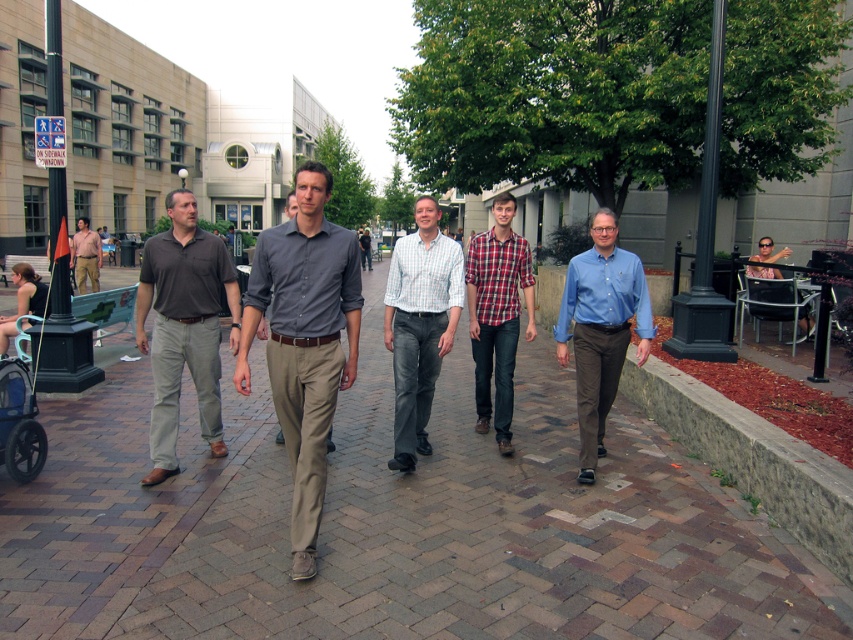
You are a delivery robot with a 1.5 meter wide package. You need to move from the matte khaki pants at center to the matte brown shirt at left. Can you navigate the path between them without moving the package sideways?

The distance between the matte khaki pants at center and the matte brown shirt at left is 13.25 meters. Since the package is only 1.5 meters wide, the robot can move straight through the path as the distance is sufficient and there is no mention of obstacles. However, the question specifies not moving the package sideways, so assuming the path width is adequate, yes, it can navigate.

You are a photographer standing at the end of the brick pathway. You want to capture a photo that includes both the plaid cotton shirt at center and the blue plastic baby carriage at lower left. Given their height difference, which object will appear larger in the photo?

The plaid cotton shirt at center will appear larger in the photo because it is much taller than the blue plastic baby carriage at lower left.

You are a fashion designer observing the group of people walking along the pathway. You notice the matte khaki pants at center and the matte brown shirt at left. Which clothing item is shorter in length?

The matte khaki pants at center is shorter than the matte brown shirt at left.